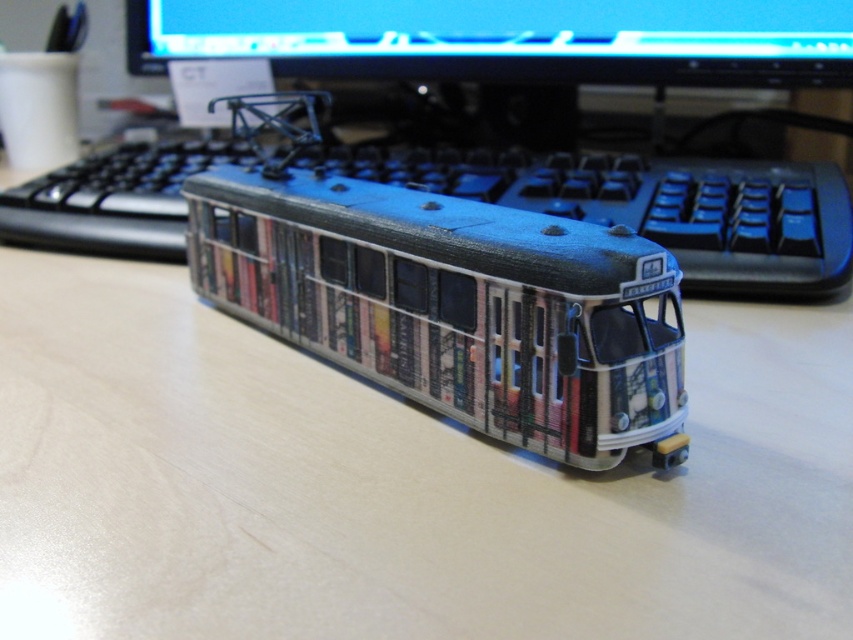
What are the coordinates of the metallic silver tram at center?

The metallic silver tram at center is located at point (456, 305).

You are organizing a model display and need to place the metallic silver tram at center and the matte black monitor at upper center on a shelf. The shelf has a height limit of 10 cm. Can both items fit vertically without exceeding the height limit?

The metallic silver tram at center has a smaller size compared to matte black monitor at upper center, but the exact heights are not provided. Without knowing their specific dimensions, it is impossible to determine if they will fit within the 10 cm height limit.

You are setting up a desk for a model tram display. You have a blue plastic keyboard at center and a matte black monitor at upper center. Which object is taller?

The blue plastic keyboard at center is taller than the matte black monitor at upper center according to the description.